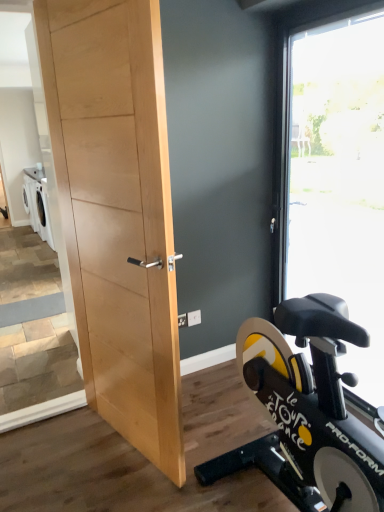
I want to click on natural wood door at center, so click(117, 212).

Describe the element at coordinates (117, 212) in the screenshot. I see `natural wood door at center` at that location.

Describe the element at coordinates (340, 180) in the screenshot. Image resolution: width=384 pixels, height=512 pixels. I see `transparent glass window at right` at that location.

Find the location of `transparent glass window at right`. transparent glass window at right is located at coordinates (340, 180).

Where is `natural wood door at center`? This screenshot has width=384, height=512. natural wood door at center is located at coordinates point(117,212).

Considering the relative positions of natural wood door at center and transparent glass window at right in the image provided, is natural wood door at center to the right of transparent glass window at right from the viewer's perspective?

No, natural wood door at center is not to the right of transparent glass window at right.

Does natural wood door at center lie in front of transparent glass window at right?

Yes, natural wood door at center is closer to the camera.

Which is less distant, (133, 53) or (298, 292)?

Point (133, 53) appears to be closer to the viewer than point (298, 292).

From the image's perspective, would you say natural wood door at center is positioned over transparent glass window at right?

No, from the image's perspective, natural wood door at center is not on top of transparent glass window at right.

From a real-world perspective, is natural wood door at center located higher than transparent glass window at right?

Yes, from a real-world perspective, natural wood door at center is on top of transparent glass window at right.

Is natural wood door at center wider or thinner than transparent glass window at right?

Considering their sizes, natural wood door at center looks slimmer than transparent glass window at right.

Who is taller, natural wood door at center or transparent glass window at right?

Standing taller between the two is transparent glass window at right.

Considering the relative sizes of natural wood door at center and transparent glass window at right in the image provided, is natural wood door at center bigger than transparent glass window at right?

Incorrect, natural wood door at center is not larger than transparent glass window at right.

Is transparent glass window at right completely or partially inside natural wood door at center?

No, transparent glass window at right is not inside natural wood door at center.

Does natural wood door at center touch transparent glass window at right?

No, natural wood door at center is not in contact with transparent glass window at right.

Is natural wood door at center facing towards transparent glass window at right?

No, natural wood door at center is not aimed at transparent glass window at right.

How far apart are natural wood door at center and transparent glass window at right?

They are 4.22 feet apart.

Image resolution: width=384 pixels, height=512 pixels. What are the coordinates of `window lying behind the natural wood door at center` in the screenshot? It's located at (340, 180).

From the picture: Which is more to the left, transparent glass window at right or natural wood door at center?

Positioned to the left is natural wood door at center.

Is transparent glass window at right closer to camera compared to natural wood door at center?

That is False.

Is point (366, 202) positioned in front of point (60, 140)?

That is False.

From the image's perspective, who appears lower, transparent glass window at right or natural wood door at center?

natural wood door at center, from the image's perspective.

From a real-world perspective, is transparent glass window at right positioned above or below natural wood door at center?

transparent glass window at right is below natural wood door at center.

Does transparent glass window at right have a lesser width compared to natural wood door at center?

Incorrect, the width of transparent glass window at right is not less than that of natural wood door at center.

Considering the relative sizes of transparent glass window at right and natural wood door at center in the image provided, is transparent glass window at right taller than natural wood door at center?

Correct, transparent glass window at right is much taller as natural wood door at center.

Which of these two, transparent glass window at right or natural wood door at center, is smaller?

With smaller size is natural wood door at center.

Is natural wood door at center inside transparent glass window at right?

No.

Is transparent glass window at right next to natural wood door at center?

There is a gap between transparent glass window at right and natural wood door at center.

Is transparent glass window at right oriented towards natural wood door at center?

Yes.

Can you tell me how much transparent glass window at right and natural wood door at center differ in facing direction?

transparent glass window at right and natural wood door at center are facing 15.4 degrees away from each other.

At what (x,y) coordinates should I click in order to perform the action: click on barn door that is on the left side of transparent glass window at right. Please return your answer as a coordinate pair (x, y). This screenshot has height=512, width=384. Looking at the image, I should click on (117, 212).

Image resolution: width=384 pixels, height=512 pixels. I want to click on barn door above the transparent glass window at right (from a real-world perspective), so click(117, 212).

Find the location of `window to the right of natural wood door at center`. window to the right of natural wood door at center is located at coordinates (340, 180).